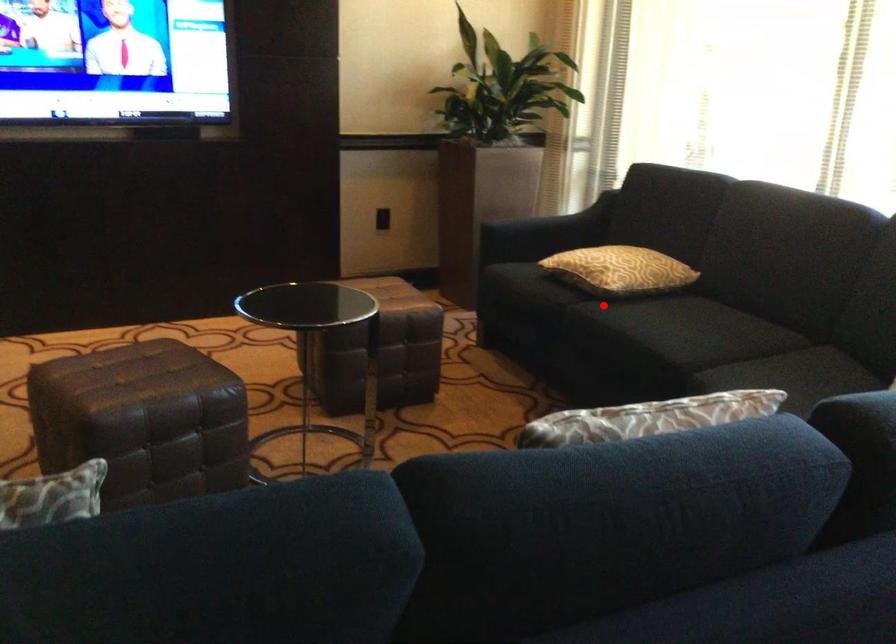
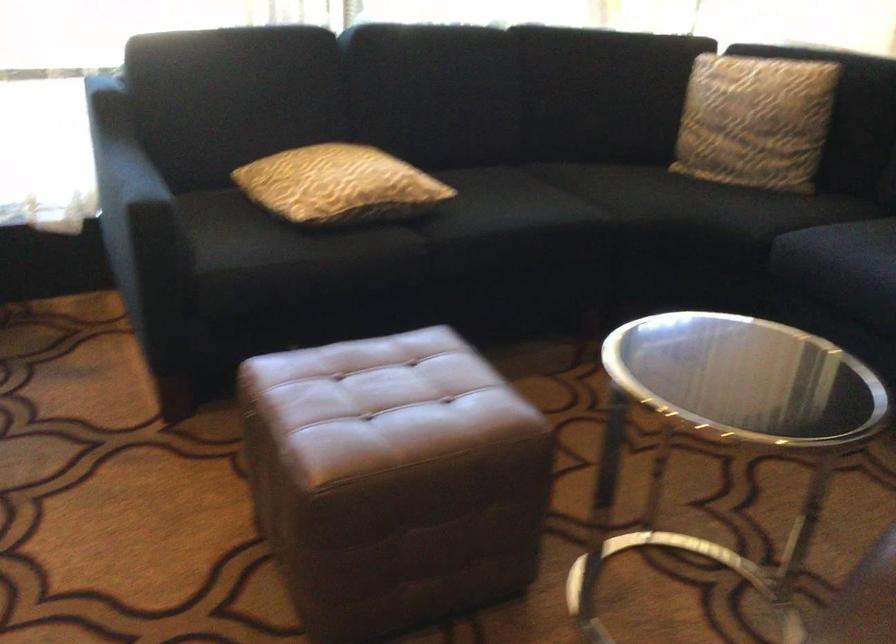
Question: I am providing you with two images of the same scene from different viewpoints. Image1 has a red point marked. In image2, the corresponding 3D location appears at what relative position? Reply with the corresponding letter.

Choices:
 (A) Closer
 (B) Farther

Answer: (A)